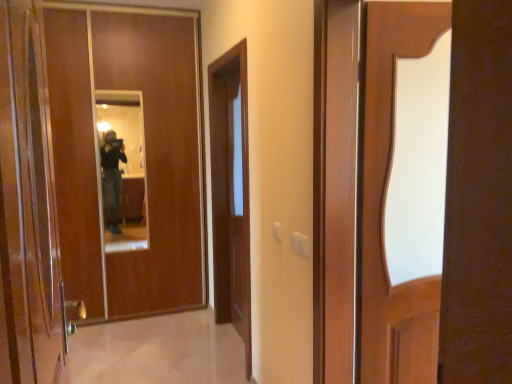
Question: Looking at their shapes, would you say matte wooden mirror at center is wider or thinner than brown wooden door at center?

Choices:
 (A) thin
 (B) wide

Answer: (A)

Question: Is matte wooden mirror at center inside or outside of brown wooden door at center?

Choices:
 (A) outside
 (B) inside

Answer: (A)

Question: Which is farther from the brown wooden door at center?

Choices:
 (A) shiny brown door at left, the 1th door positioned from the front
 (B) matte wood door at left, the 1th door positioned from the back
 (C) matte wooden mirror at center

Answer: (A)

Question: Which object is the farthest from the matte wood door at left, the 1th door positioned from the back?

Choices:
 (A) shiny brown door at left, the 2th door positioned from the back
 (B) brown wooden door at center
 (C) matte wooden mirror at center

Answer: (A)